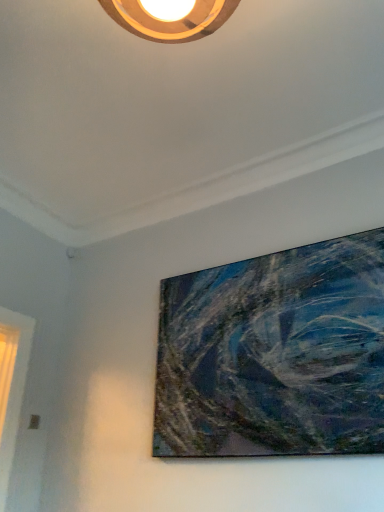
Image resolution: width=384 pixels, height=512 pixels. What do you see at coordinates (275, 354) in the screenshot?
I see `textured canvas painting at center` at bounding box center [275, 354].

Identify the location of textured canvas painting at center. (275, 354).

Locate an element on the screen. Image resolution: width=384 pixels, height=512 pixels. textured canvas painting at center is located at coordinates (275, 354).